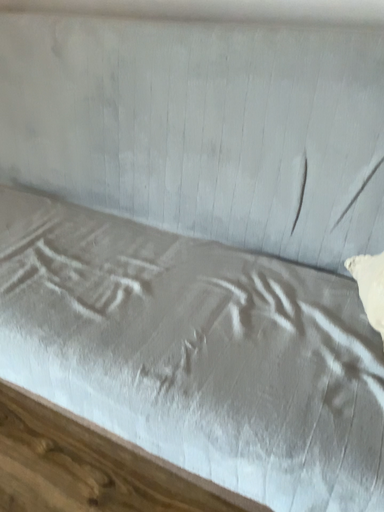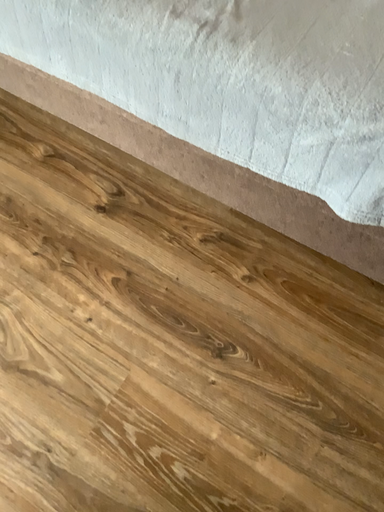
Question: Which way did the camera rotate in the video?

Choices:
 (A) rotated upward
 (B) rotated downward

Answer: (B)